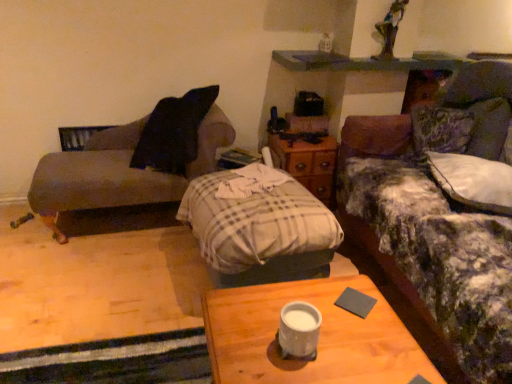
Locate an element on the screen. vacant space to the right of white matte coffee cup at center is located at coordinates (354, 347).